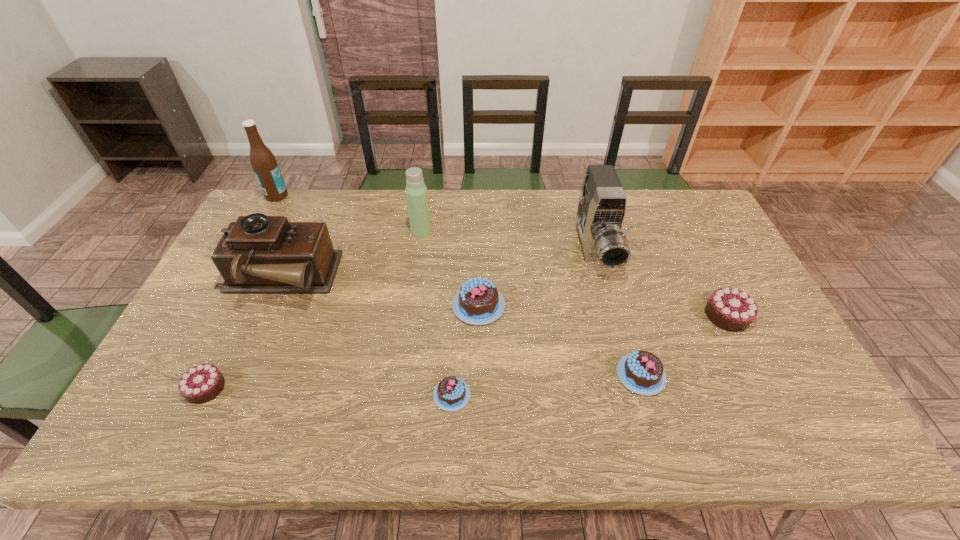
Identify the location of the tallest object. (264, 164).

Find the location of a particular element. The height and width of the screenshot is (540, 960). the farthest object is located at coordinates (264, 164).

At what (x,y) coordinates should I click in order to perform the action: click on camcorder. Please return your answer as a coordinate pair (x, y). Image resolution: width=960 pixels, height=540 pixels. Looking at the image, I should click on (601, 211).

Where is `light thermos bottle`? The height and width of the screenshot is (540, 960). light thermos bottle is located at coordinates (416, 191).

Find the location of `the sixth object from right to left`. the sixth object from right to left is located at coordinates point(416,191).

At what (x,y) coordinates should I click in order to perform the action: click on phonograph_record. Please return your answer as a coordinate pair (x, y). The image size is (960, 540). Looking at the image, I should click on (259, 254).

Identify the location of the biggest pink chocolate cake. The width and height of the screenshot is (960, 540). (478, 302).

You are a GUI agent. You are given a task and a screenshot of the screen. Output one action in this format:
    pyautogui.click(x=<x>, y=<y>)
    Task: Click on the rightmost chocolate cake
    Image resolution: width=960 pixels, height=540 pixels.
    Given the screenshot: What is the action you would take?
    pyautogui.click(x=733, y=310)

Identify the location of the right chocolate chocolate cake. The height and width of the screenshot is (540, 960). coord(733,310).

This screenshot has width=960, height=540. Identify the location of the rightmost pink chocolate cake. pyautogui.click(x=642, y=372).